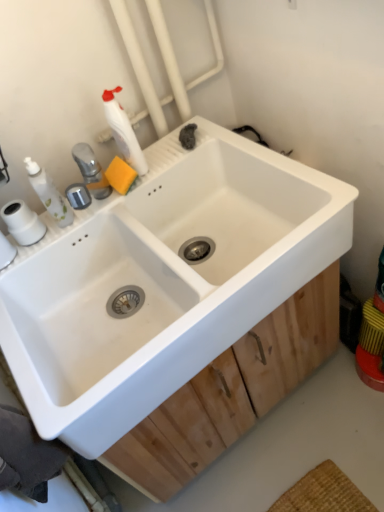
Question: Considering the relative sizes of white ceramic sink at center and white matte bottle at upper left in the image provided, is white ceramic sink at center shorter than white matte bottle at upper left?

Choices:
 (A) no
 (B) yes

Answer: (A)

Question: From a real-world perspective, is white ceramic sink at center on top of white matte bottle at upper left?

Choices:
 (A) no
 (B) yes

Answer: (A)

Question: From a real-world perspective, is white ceramic sink at center located beneath white matte bottle at upper left?

Choices:
 (A) yes
 (B) no

Answer: (A)

Question: Is white ceramic sink at center next to white matte bottle at upper left?

Choices:
 (A) no
 (B) yes

Answer: (A)

Question: Is white ceramic sink at center facing towards white matte bottle at upper left?

Choices:
 (A) yes
 (B) no

Answer: (B)

Question: Is white matte bottle at upper left inside the boundaries of white matte toilet paper at left, or outside?

Choices:
 (A) outside
 (B) inside

Answer: (A)

Question: From a real-world perspective, is white matte bottle at upper left above or below white matte toilet paper at left?

Choices:
 (A) below
 (B) above

Answer: (B)

Question: In the image, is white matte bottle at upper left positioned in front of or behind white matte toilet paper at left?

Choices:
 (A) front
 (B) behind

Answer: (A)

Question: Is white matte bottle at upper left to the left or to the right of white matte toilet paper at left in the image?

Choices:
 (A) right
 (B) left

Answer: (A)

Question: Based on their positions, is white matte bottle at upper left located to the left or right of wooden at center?

Choices:
 (A) left
 (B) right

Answer: (A)

Question: Is white matte bottle at upper left taller or shorter than wooden at center?

Choices:
 (A) short
 (B) tall

Answer: (B)

Question: Looking at the image, does white matte bottle at upper left seem bigger or smaller compared to wooden at center?

Choices:
 (A) small
 (B) big

Answer: (A)

Question: From the image's perspective, is white matte bottle at upper left above or below wooden at center?

Choices:
 (A) below
 (B) above

Answer: (B)

Question: Is point (157, 437) positioned closer to the camera than point (26, 305)?

Choices:
 (A) farther
 (B) closer

Answer: (B)

Question: Looking at the image, does wooden at center seem bigger or smaller compared to white ceramic sink at center?

Choices:
 (A) small
 (B) big

Answer: (A)